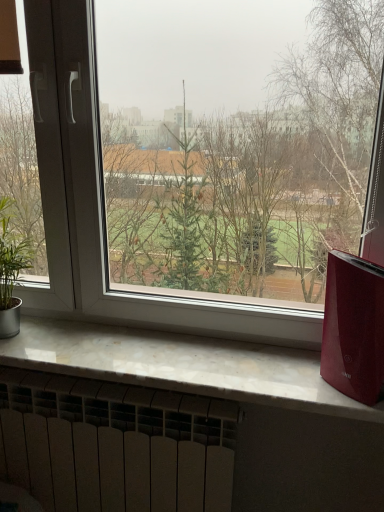
What is the approximate height of transparent glass window at center?

36.15 inches.

You are a GUI agent. You are given a task and a screenshot of the screen. Output one action in this format:
    pyautogui.click(x=<x>, y=<y>)
    Task: Click on the white marble window sill at lower center
    
    Given the screenshot: What is the action you would take?
    click(x=182, y=365)

You are a GUI agent. You are given a task and a screenshot of the screen. Output one action in this format:
    pyautogui.click(x=<x>, y=<y>)
    Task: Click on the white matte radiator at bottom
    This screenshot has height=512, width=384.
    Given the screenshot: What is the action you would take?
    pyautogui.click(x=114, y=445)

Locate an element on the screen. transparent glass window at center is located at coordinates (103, 206).

At what (x,y) coordinates should I click in order to perform the action: click on window sill beneath the transparent glass window at center (from a real-world perspective). Please return your answer as a coordinate pair (x, y). The image size is (384, 512). Looking at the image, I should click on (182, 365).

Which of these two, transparent glass window at center or white marble window sill at lower center, is thinner?

transparent glass window at center is thinner.

Between point (313, 317) and point (27, 355), which one is positioned behind?

The point (313, 317) is more distant.

The image size is (384, 512). Identify the location of appliance above the white matte radiator at bottom (from a real-world perspective). (354, 328).

Would you say shiny red air purifier at right is to the left or to the right of white matte radiator at bottom in the picture?

Clearly, shiny red air purifier at right is on the right of white matte radiator at bottom in the image.

Is shiny red air purifier at right positioned beyond the bounds of white matte radiator at bottom?

That's correct, shiny red air purifier at right is outside of white matte radiator at bottom.

From a real-world perspective, is shiny red air purifier at right below white matte radiator at bottom?

No.

Does green leafy plant at left lie behind white marble window sill at lower center?

Yes, green leafy plant at left is further from the viewer.

How much distance is there between green leafy plant at left and white marble window sill at lower center?

green leafy plant at left and white marble window sill at lower center are 17.61 inches apart.

From the picture: From the image's perspective, is green leafy plant at left on top of white marble window sill at lower center?

Yes, from the image's perspective, green leafy plant at left is over white marble window sill at lower center.

From a real-world perspective, which is physically above, green leafy plant at left or white marble window sill at lower center?

In real-world perspective, green leafy plant at left is above.

Which object is positioned more to the left, white matte radiator at bottom or white marble window sill at lower center?

Positioned to the left is white matte radiator at bottom.

How different are the orientations of white matte radiator at bottom and white marble window sill at lower center in degrees?

0.681 degrees.

Considering the positions of objects white matte radiator at bottom and white marble window sill at lower center in the image provided, who is in front, white matte radiator at bottom or white marble window sill at lower center?

white marble window sill at lower center is in front.

Is white matte radiator at bottom smaller than white marble window sill at lower center?

No, white matte radiator at bottom is not smaller than white marble window sill at lower center.

Is white marble window sill at lower center next to green leafy plant at left?

They are not placed beside each other.

Considering the positions of point (272, 385) and point (6, 241), is point (272, 385) closer or farther from the camera than point (6, 241)?

Point (272, 385) appears to be closer to the viewer than point (6, 241).

How different are the orientations of white marble window sill at lower center and green leafy plant at left in degrees?

0.136 degrees separate the facing orientations of white marble window sill at lower center and green leafy plant at left.

Based on the photo, is white marble window sill at lower center smaller than green leafy plant at left?

No, white marble window sill at lower center is not smaller than green leafy plant at left.

Is white marble window sill at lower center not close to shiny red air purifier at right?

No, white marble window sill at lower center is not far from shiny red air purifier at right.

Considering the positions of objects white marble window sill at lower center and shiny red air purifier at right in the image provided, who is more to the left, white marble window sill at lower center or shiny red air purifier at right?

white marble window sill at lower center is more to the left.

From the image's perspective, which object appears higher, white marble window sill at lower center or shiny red air purifier at right?

shiny red air purifier at right appears higher in the image.

Is white marble window sill at lower center smaller than shiny red air purifier at right?

No.

This screenshot has width=384, height=512. In order to click on window sill located behind the transparent glass window at center in this screenshot , I will do (182, 365).

Who is smaller, white marble window sill at lower center or transparent glass window at center?

Smaller between the two is white marble window sill at lower center.

Does white marble window sill at lower center turn towards transparent glass window at center?

No, white marble window sill at lower center does not turn towards transparent glass window at center.

Is point (146, 379) closer or farther from the camera than point (51, 138)?

Point (146, 379) is closer to the camera than point (51, 138).

At what (x,y) coordinates should I click in order to perform the action: click on window sill located behind the transparent glass window at center. Please return your answer as a coordinate pair (x, y). Image resolution: width=384 pixels, height=512 pixels. Looking at the image, I should click on (182, 365).

The width and height of the screenshot is (384, 512). I want to click on radiator on the left of the shiny red air purifier at right, so click(x=114, y=445).

Looking at the image, which one is located closer to white matte radiator at bottom, transparent glass window at center or shiny red air purifier at right?

Among the two, transparent glass window at center is located nearer to white matte radiator at bottom.

Considering their positions, is white marble window sill at lower center positioned further to white matte radiator at bottom than transparent glass window at center?

transparent glass window at center is further to white matte radiator at bottom.

From the image, which object appears to be farther from transparent glass window at center, white marble window sill at lower center or green leafy plant at left?

Among the two, green leafy plant at left is located further to transparent glass window at center.

When comparing their distances from white marble window sill at lower center, does shiny red air purifier at right or transparent glass window at center seem closer?

Among the two, transparent glass window at center is located nearer to white marble window sill at lower center.

When comparing their distances from transparent glass window at center, does shiny red air purifier at right or green leafy plant at left seem further?

shiny red air purifier at right is further to transparent glass window at center.

Looking at this image, looking at the image, which one is located closer to green leafy plant at left, white marble window sill at lower center or transparent glass window at center?

Based on the image, transparent glass window at center appears to be nearer to green leafy plant at left.

Which object lies further to the anchor point green leafy plant at left, transparent glass window at center or white marble window sill at lower center?

white marble window sill at lower center lies further to green leafy plant at left than the other object.

Looking at the image, which one is located further to shiny red air purifier at right, transparent glass window at center or white matte radiator at bottom?

Among the two, white matte radiator at bottom is located further to shiny red air purifier at right.

Identify the location of houseplant that lies between transparent glass window at center and white matte radiator at bottom from top to bottom. (11, 269).

I want to click on window sill between green leafy plant at left and shiny red air purifier at right in the horizontal direction, so click(182, 365).

I want to click on window sill between white matte radiator at bottom and shiny red air purifier at right in the horizontal direction, so click(182, 365).

The image size is (384, 512). Identify the location of window located between green leafy plant at left and shiny red air purifier at right in the left-right direction. (103, 206).